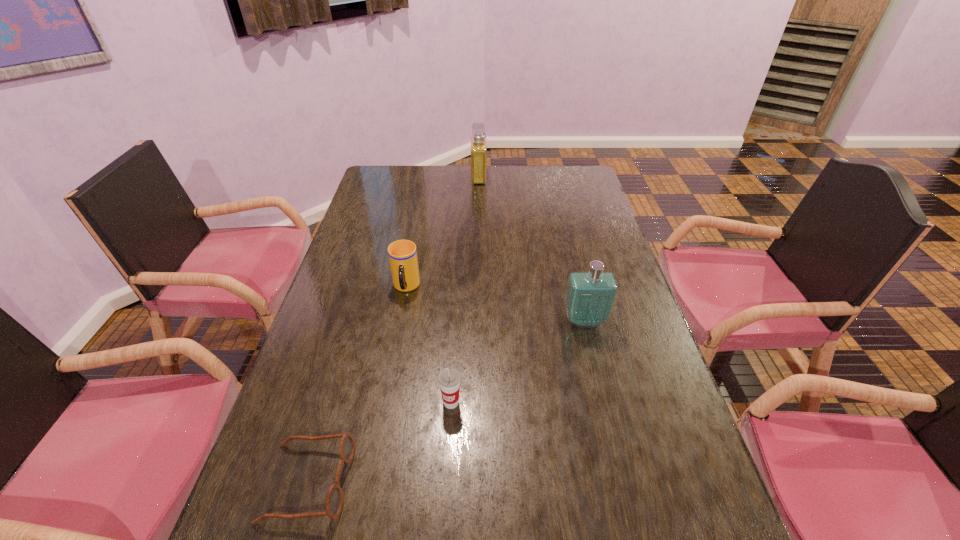
Where is `the fourth object from left to right`? This screenshot has width=960, height=540. the fourth object from left to right is located at coordinates (478, 139).

What are the coordinates of `the farthest object` in the screenshot? It's located at (478, 139).

What are the coordinates of `the third nearest object` in the screenshot? It's located at (590, 297).

Locate an element on the screen. the right perfume is located at coordinates (590, 297).

This screenshot has height=540, width=960. Find the location of `the farther cup`. the farther cup is located at coordinates (402, 254).

Locate an element on the screen. This screenshot has width=960, height=540. the fourth nearest object is located at coordinates (402, 254).

You are a GUI agent. You are given a task and a screenshot of the screen. Output one action in this format:
    pyautogui.click(x=<x>, y=<y>)
    Task: Click on the third object from left to right
    Image resolution: width=960 pixels, height=540 pixels.
    Given the screenshot: What is the action you would take?
    pyautogui.click(x=449, y=378)

I want to click on the nearer cup, so click(449, 378).

What are the coordinates of `the nearest object` in the screenshot? It's located at (334, 503).

Identify the location of spectacles. (334, 503).